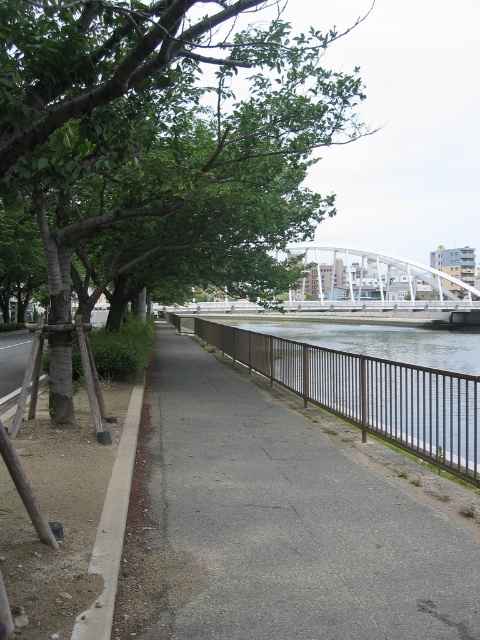
Does gray asphalt pavement at center have a lesser width compared to gray concrete curb at lower left?

Incorrect, gray asphalt pavement at center's width is not less than gray concrete curb at lower left's.

Is point (454, 598) farther from viewer compared to point (112, 464)?

No.

This screenshot has width=480, height=640. In order to click on gray asphalt pavement at center in this screenshot , I will do [274, 524].

Find the location of a particular element. This screenshot has height=640, width=480. gray asphalt pavement at center is located at coordinates (274, 524).

Is white metallic bridge at center behind gray concrete curb at lower left?

Yes, white metallic bridge at center is behind gray concrete curb at lower left.

Does point (351, 250) lie in front of point (108, 493)?

No.

Where is `white metallic bridge at center`? This screenshot has width=480, height=640. white metallic bridge at center is located at coordinates (372, 282).

Can you confirm if gray asphalt pavement at center is smaller than brown metal fence at center?

Correct, gray asphalt pavement at center occupies less space than brown metal fence at center.

Between gray asphalt pavement at center and brown metal fence at center, which one has less height?

Standing shorter between the two is gray asphalt pavement at center.

Does point (314, 515) come farther from viewer compared to point (249, 365)?

No.

Identify the location of gray asphalt pavement at center. Image resolution: width=480 pixels, height=640 pixels. (274, 524).